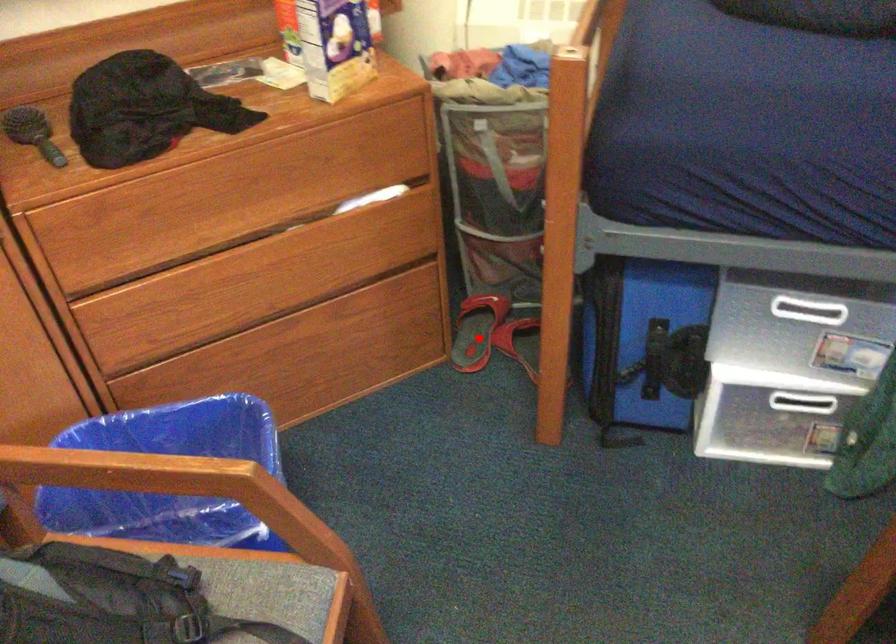
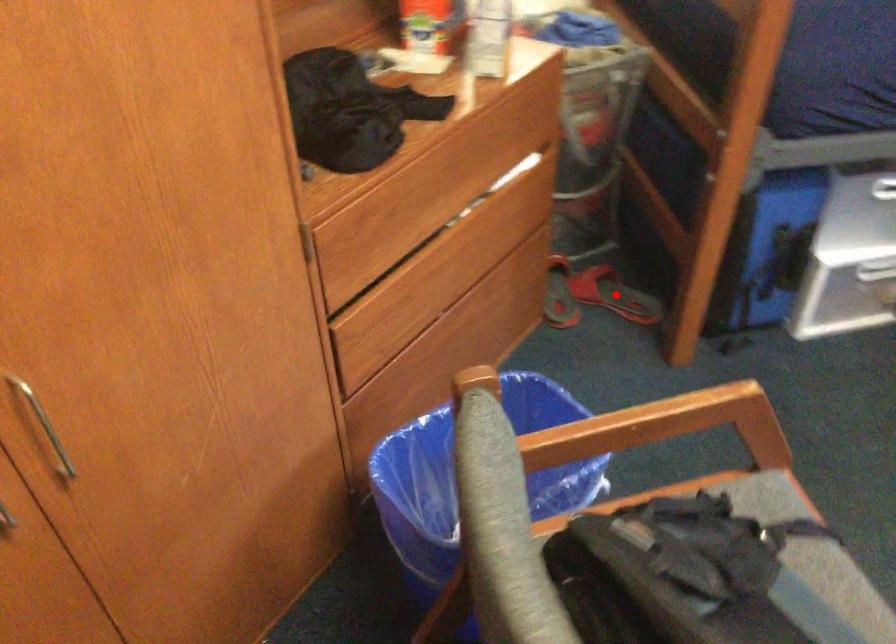
I am providing you with two images of the same scene from different viewpoints. A red point is marked on the first image and another point is marked on the second image. Is the marked point in image1 the same physical position as the marked point in image2?

No